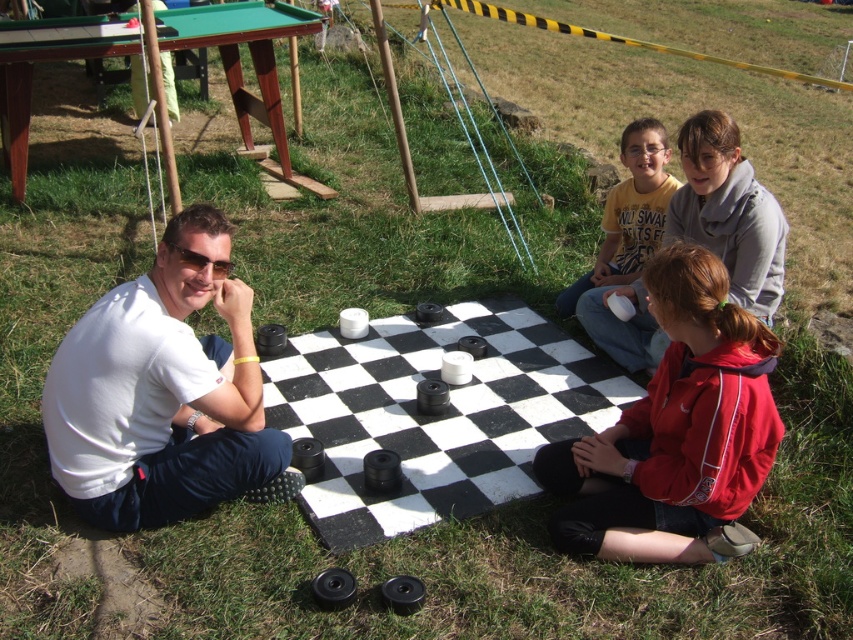
Is point (552, 392) less distant than point (735, 401)?

No, (552, 392) is behind (735, 401).

Is black rubber checkerboard at center thinner than red fleece jacket at lower right?

No, black rubber checkerboard at center is not thinner than red fleece jacket at lower right.

What do you see at coordinates (434, 417) in the screenshot? I see `black rubber checkerboard at center` at bounding box center [434, 417].

I want to click on black rubber checkerboard at center, so tap(434, 417).

Is red fleece jacket at lower right to the right of yellow cotton shirt at center from the viewer's perspective?

Incorrect, red fleece jacket at lower right is not on the right side of yellow cotton shirt at center.

Between red fleece jacket at lower right and yellow cotton shirt at center, which one appears on the right side from the viewer's perspective?

yellow cotton shirt at center is more to the right.

The image size is (853, 640). Identify the location of red fleece jacket at lower right. (675, 432).

From the picture: Does white matte shirt at left have a lesser width compared to yellow cotton shirt at center?

No.

This screenshot has width=853, height=640. Identify the location of white matte shirt at left. (164, 392).